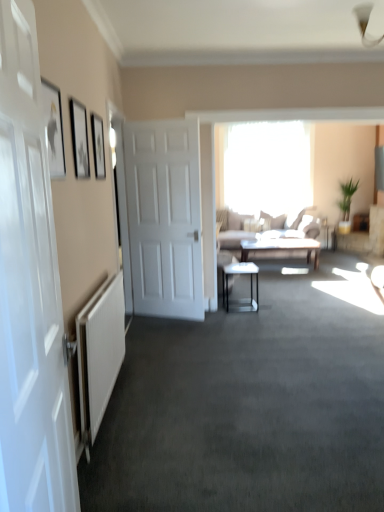
Question: Which direction should I rotate to look at matte gray table at center, marked as the 1th table in a back-to-front arrangement, — up or down?

Choices:
 (A) down
 (B) up

Answer: (B)

Question: From a real-world perspective, is white textured radiator at lower left physically below matte black picture frame at upper left, the first picture frame from the back?

Choices:
 (A) yes
 (B) no

Answer: (A)

Question: Can you confirm if white textured radiator at lower left is shorter than matte black picture frame at upper left, the 3th picture frame positioned from the front?

Choices:
 (A) yes
 (B) no

Answer: (B)

Question: Is white textured radiator at lower left thinner than matte black picture frame at upper left, the first picture frame from the back?

Choices:
 (A) yes
 (B) no

Answer: (B)

Question: Is white textured radiator at lower left turned away from matte black picture frame at upper left, the first picture frame from the back?

Choices:
 (A) no
 (B) yes

Answer: (A)

Question: Is matte black picture frame at upper left, the first picture frame from the back, a part of white textured radiator at lower left?

Choices:
 (A) no
 (B) yes

Answer: (A)

Question: Is white textured radiator at lower left positioned behind matte black picture frame at upper left, the 3th picture frame positioned from the front?

Choices:
 (A) no
 (B) yes

Answer: (A)

Question: Considering the relative positions of white glossy door at left, the first door from the front, and light brown fabric couch at center in the image provided, is white glossy door at left, the first door from the front, to the left of light brown fabric couch at center from the viewer's perspective?

Choices:
 (A) yes
 (B) no

Answer: (A)

Question: Is white glossy door at left, placed as the second door when sorted from back to front, behind light brown fabric couch at center?

Choices:
 (A) yes
 (B) no

Answer: (B)

Question: Could you tell me if white glossy door at left, the first door from the front, is facing light brown fabric couch at center?

Choices:
 (A) no
 (B) yes

Answer: (A)

Question: Considering the relative sizes of white glossy door at left, placed as the second door when sorted from back to front, and light brown fabric couch at center in the image provided, is white glossy door at left, placed as the second door when sorted from back to front, taller than light brown fabric couch at center?

Choices:
 (A) yes
 (B) no

Answer: (A)

Question: From a real-world perspective, is white glossy door at left, placed as the second door when sorted from back to front, physically below light brown fabric couch at center?

Choices:
 (A) no
 (B) yes

Answer: (A)

Question: Does white glossy door at left, the first door from the front, have a greater width compared to light brown fabric couch at center?

Choices:
 (A) no
 (B) yes

Answer: (A)

Question: Are metallic glass table at center, arranged as the 2th table when viewed from the back, and white glossy door at left, placed as the second door when sorted from back to front, located far from each other?

Choices:
 (A) yes
 (B) no

Answer: (A)